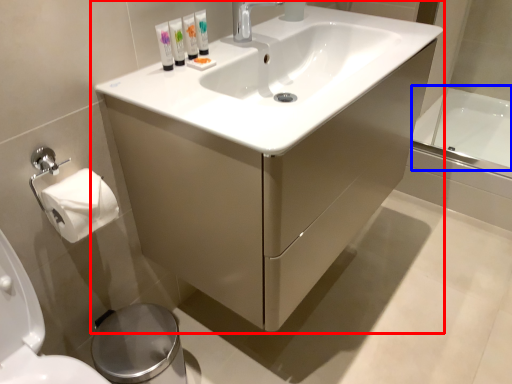
Question: Which object appears closest to the camera in this image, bathroom cabinet (highlighted by a red box) or bath (highlighted by a blue box)?

Choices:
 (A) bathroom cabinet
 (B) bath

Answer: (A)